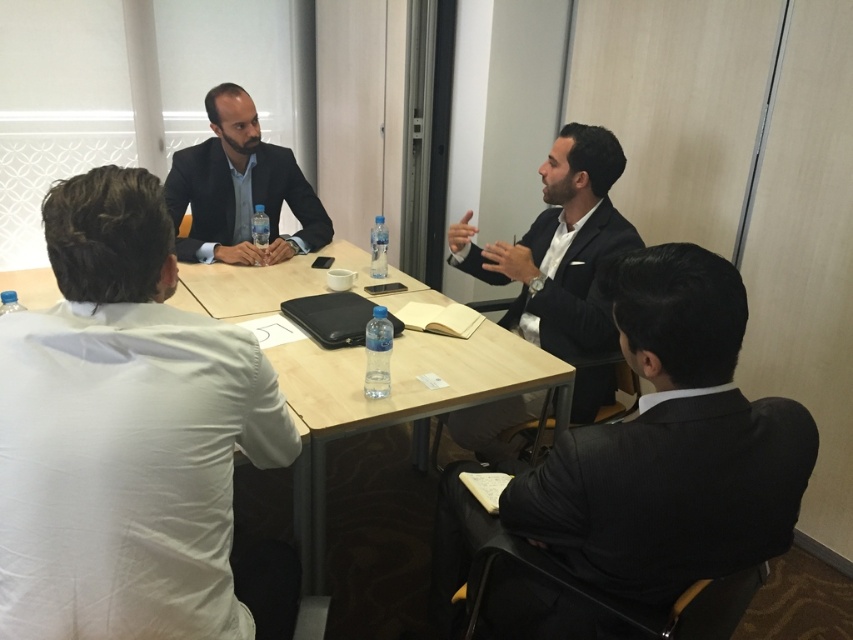
Is black suit at lower right wider than matte black suit at center?

Yes.

Is point (633, 540) positioned in front of point (242, 196)?

Yes, it is in front of point (242, 196).

The image size is (853, 640). I want to click on black suit at lower right, so click(671, 445).

Looking at this image, can you confirm if wooden table at center is thinner than matte black suit at center?

In fact, wooden table at center might be wider than matte black suit at center.

Identify the location of wooden table at center. (x=393, y=404).

Where is `wooden table at center`? This screenshot has height=640, width=853. wooden table at center is located at coordinates (393, 404).

Between white cotton shirt at left and matte black suit at center, which one has more height?

With more height is white cotton shirt at left.

Who is positioned more to the right, white cotton shirt at left or matte black suit at center?

white cotton shirt at left is more to the right.

You are a GUI agent. You are given a task and a screenshot of the screen. Output one action in this format:
    pyautogui.click(x=<x>, y=<y>)
    Task: Click on the white cotton shirt at left
    The height and width of the screenshot is (640, 853).
    Given the screenshot: What is the action you would take?
    pyautogui.click(x=131, y=440)